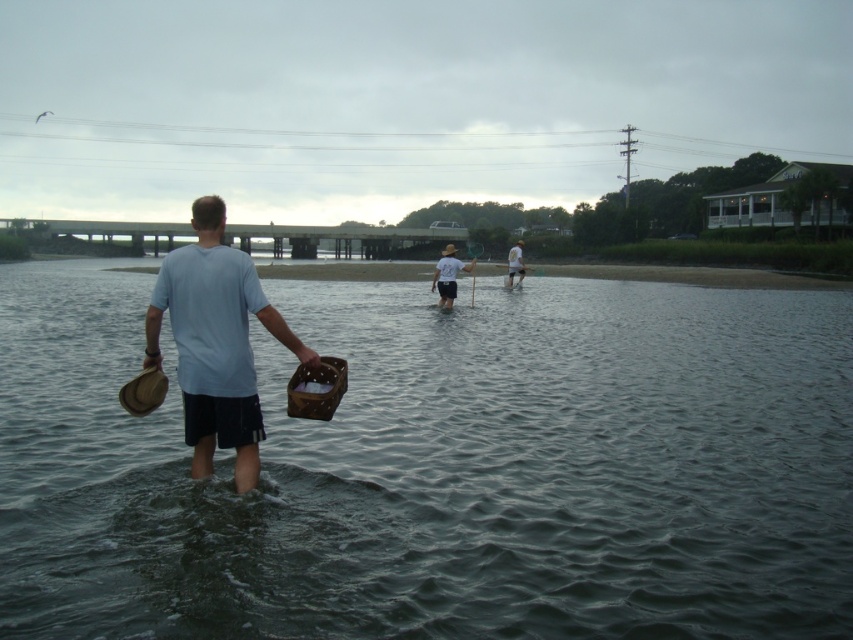
Question: Which object is positioned farthest from the clear water at center?

Choices:
 (A) white matte shirt at center
 (B) light blue cotton shirt at center

Answer: (A)

Question: Can you confirm if white matte shirt at center is bigger than white cotton shirt at center?

Choices:
 (A) yes
 (B) no

Answer: (B)

Question: Among these objects, which one is nearest to the camera?

Choices:
 (A) white cotton shirt at center
 (B) light blue cotton shirt at center
 (C) white matte shirt at center
 (D) clear water at center

Answer: (D)

Question: Can you confirm if clear water at center is thinner than light blue cotton shirt at center?

Choices:
 (A) no
 (B) yes

Answer: (A)

Question: Which point appears farthest from the camera in this image?

Choices:
 (A) tap(451, 264)
 (B) tap(518, 256)

Answer: (B)

Question: Does clear water at center appear on the left side of white cotton shirt at center?

Choices:
 (A) yes
 (B) no

Answer: (A)